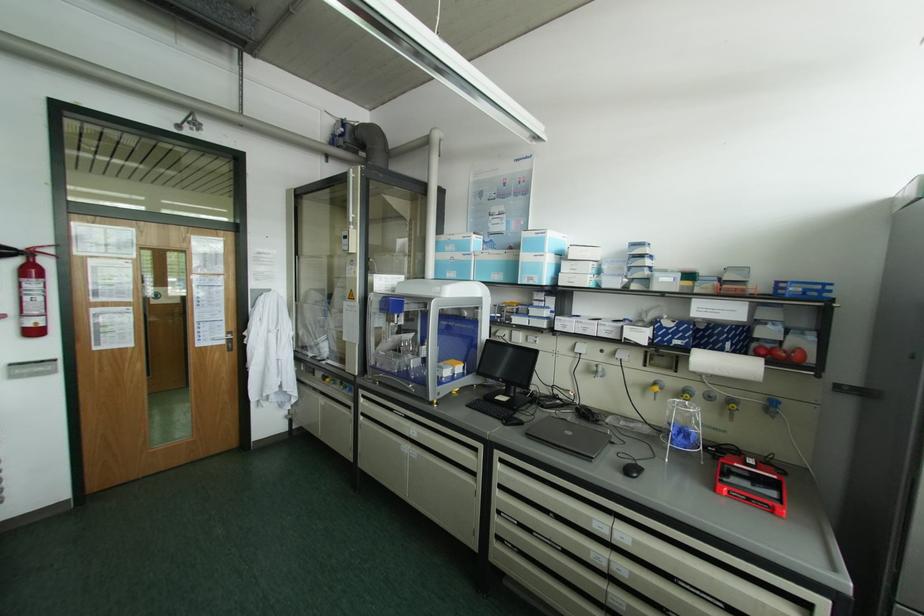
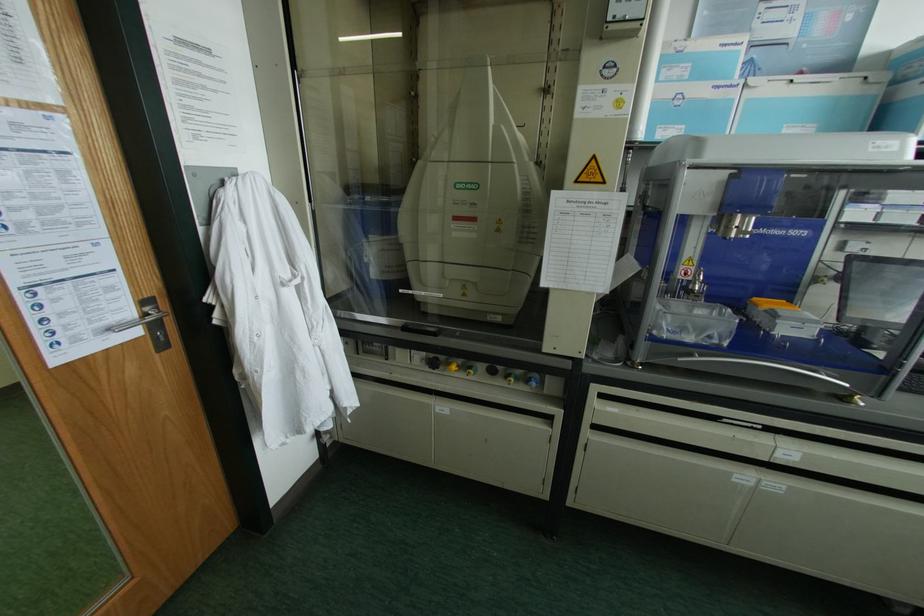
Locate, in the second image, the point that corresponds to pixel 414 430 in the first image.

(789, 451)